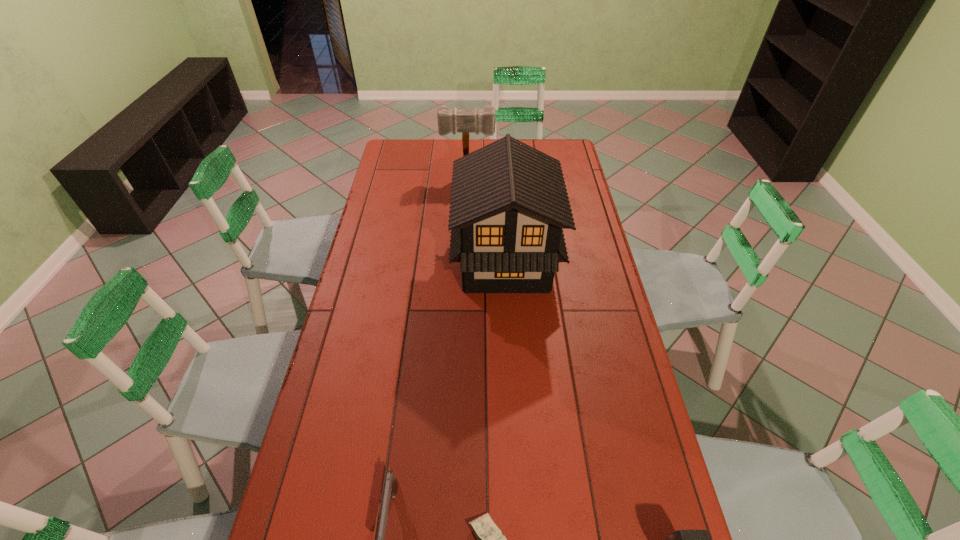
Identify the location of the fourth nearest object. The width and height of the screenshot is (960, 540). (509, 203).

This screenshot has width=960, height=540. What are the coordinates of `dollhouse` in the screenshot? It's located at 509,203.

The width and height of the screenshot is (960, 540). Identify the location of the farthest object. (465, 121).

Locate an element on the screen. This screenshot has height=540, width=960. the fourth shortest object is located at coordinates (465, 121).

Identify the location of vacant region located 0.110m on the front-facing side of the tallest object. This screenshot has height=540, width=960. (422, 262).

The image size is (960, 540). I want to click on free space located on the front-facing side of the tallest object, so click(x=388, y=262).

Locate an element on the screen. This screenshot has width=960, height=540. vacant point located on the front-facing side of the tallest object is located at coordinates (364, 262).

I want to click on free spot located 0.270m on the right of the second tallest object, so pos(552,176).

In the image, there is a desktop. Where is `free space at the far edge`? free space at the far edge is located at coordinates (433, 158).

The image size is (960, 540). In the image, there is a desktop. In order to click on vacant space at the left edge in this screenshot , I will do `click(329, 390)`.